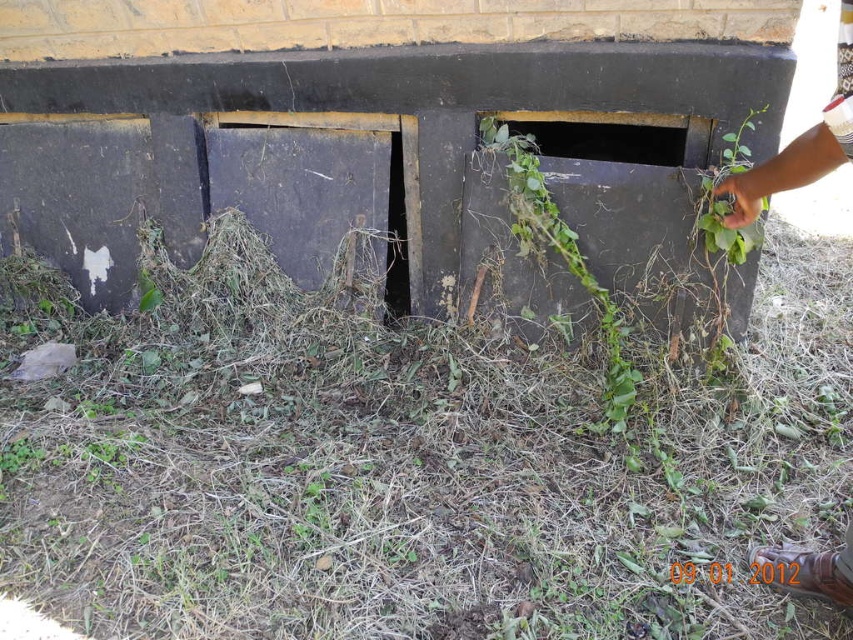
You are a gardener who needs to clear the vegetation around both the green grassy hay at lower center and the green leafy plant at upper right. Which vegetation requires more effort to remove based on their sizes?

The green grassy hay at lower center requires more effort to remove since it is larger in size than the green leafy plant at upper right.

You are standing near the building foundation and want to reach the green grassy hay at lower center. Based on its coordinates, which direction should you move relative to your current position?

The green grassy hay at lower center is located at point [405,467], which means you should move towards the lower center direction to reach it.

You are a maintenance worker who needs to locate the green leafy plant at center. According to the coordinates given, where exactly should you look on the image to find it?

The green leafy plant at center is located at the coordinates point [561,259].